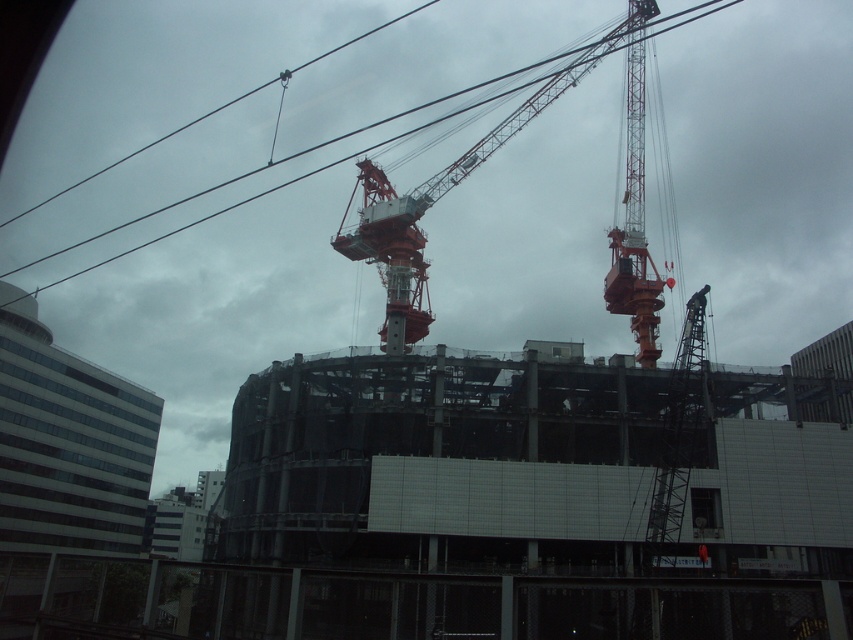
Question: Can you confirm if metallic wire at upper center is positioned to the right of metallic gray lift at center?

Choices:
 (A) no
 (B) yes

Answer: (A)

Question: Which object is the farthest from the metallic gray crane at right?

Choices:
 (A) metallic red crane at upper right
 (B) metallic wire at upper center

Answer: (B)

Question: Which point is farther from the camera taking this photo?

Choices:
 (A) (257, 170)
 (B) (631, 61)

Answer: (A)

Question: Is metallic red crane at center bigger than metallic gray lift at center?

Choices:
 (A) yes
 (B) no

Answer: (A)

Question: Which point is closer to the camera taking this photo?

Choices:
 (A) (x=524, y=342)
 (B) (x=323, y=145)

Answer: (A)

Question: Does metallic red crane at upper right have a larger size compared to metallic wire at upper center?

Choices:
 (A) no
 (B) yes

Answer: (A)